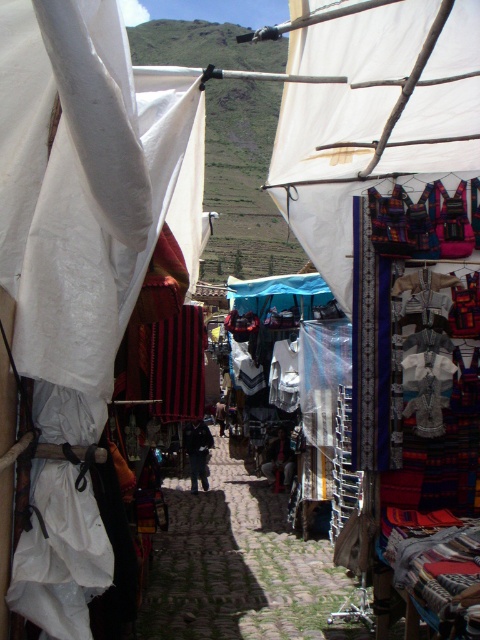
You are a traveler navigating the cobblestone alley at center and want to find the stall under the white fabric canopy at upper center. Which direction should you turn to reach it?

The white fabric canopy at upper center is positioned on the right side of cobblestone alley at center, so you should turn right to reach the stall under it.

You are a traveler carrying a large backpack and need to walk through the cobblestone alley at center. There is also a white fabric canopy at upper center above your path. Considering the size difference between them, will the canopy obstruct your head while walking through the alley?

The white fabric canopy at upper center is smaller than the cobblestone alley at center, so it may not provide sufficient coverage over the entire alley. This means the canopy might be too narrow or short to obstruct your head while walking through the cobblestone alley at center.